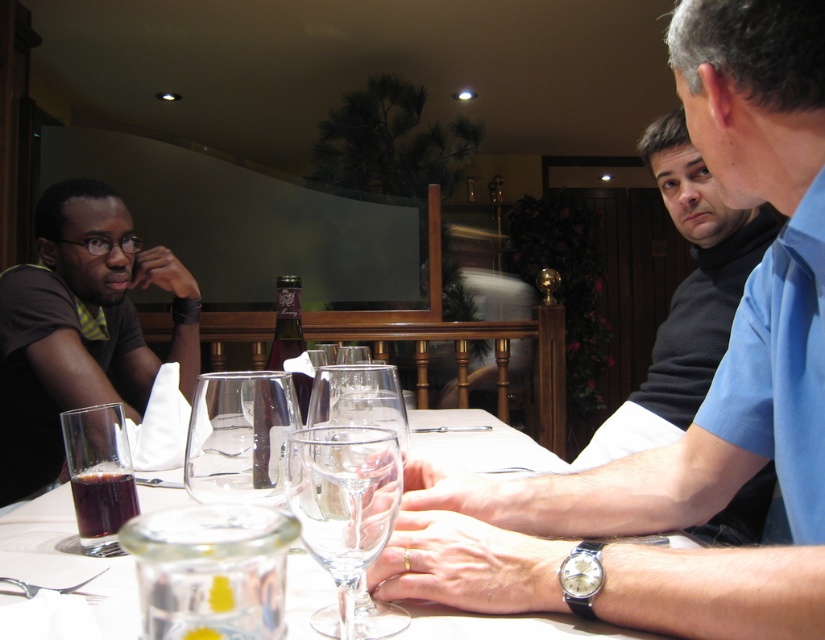
Question: Does translucent glass at lower left lie in front of dark purple glass bottle at center?

Choices:
 (A) yes
 (B) no

Answer: (A)

Question: Is clear glass wine glass at center thinner than dark glass at table left?

Choices:
 (A) yes
 (B) no

Answer: (A)

Question: Considering the real-world distances, which object is closest to the translucent glass at lower left?

Choices:
 (A) blue shirt at right
 (B) dark glass at table left
 (C) black matte shirt at upper right
 (D) clear glass wine glass at center

Answer: (B)

Question: Which of the following is the closest to the observer?

Choices:
 (A) (135, 348)
 (B) (300, 388)

Answer: (B)

Question: Which point is closer to the camera taking this photo?

Choices:
 (A) tap(484, 516)
 (B) tap(276, 324)
 (C) tap(54, 323)
 (D) tap(319, 500)

Answer: (D)

Question: Is matte black shirt at left bigger than clear glass wine glass at center?

Choices:
 (A) no
 (B) yes

Answer: (B)